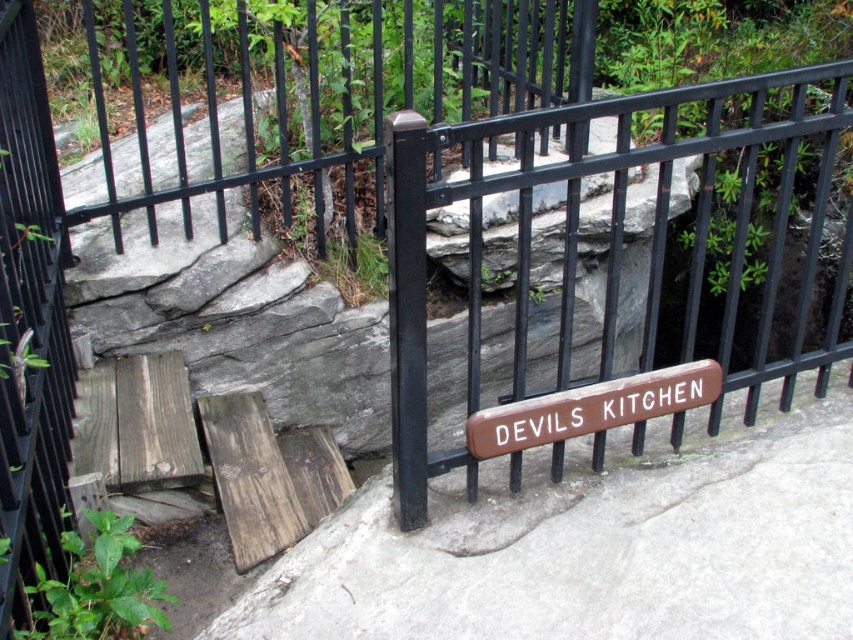
Describe the element at coordinates (595, 541) in the screenshot. I see `white concrete pavement at lower center` at that location.

Does point (469, 588) come farther from viewer compared to point (515, 449)?

No, (469, 588) is closer to viewer.

The image size is (853, 640). I want to click on white concrete pavement at lower center, so click(x=595, y=541).

Consider the image. Is white concrete pavement at lower center wider than wooden sign at center?

Yes.

Does white concrete pavement at lower center appear over wooden sign at center?

Actually, white concrete pavement at lower center is below wooden sign at center.

Who is more distant from viewer, [511,628] or [50,244]?

Positioned behind is point [50,244].

I want to click on white concrete pavement at lower center, so click(x=595, y=541).

The width and height of the screenshot is (853, 640). What do you see at coordinates (30, 321) in the screenshot?
I see `wooden sign at center` at bounding box center [30, 321].

Is wooden sign at center behind brown wooden sign at center?

No, wooden sign at center is in front of brown wooden sign at center.

Is point (32, 545) positioned behind point (613, 380)?

No, (32, 545) is closer to viewer.

Find the location of a particular element. This screenshot has width=853, height=640. wooden sign at center is located at coordinates (30, 321).